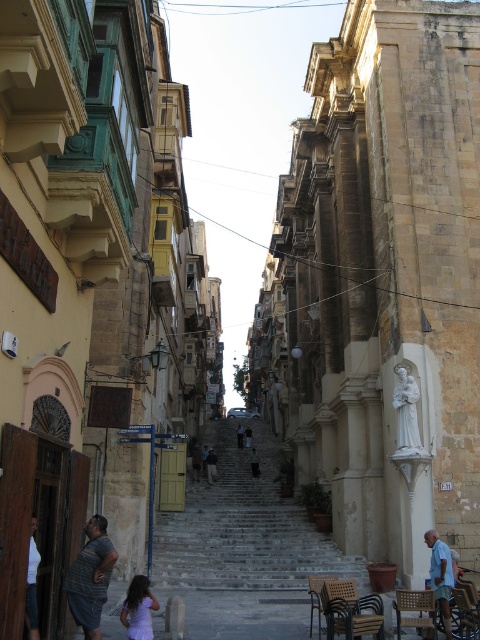
Question: Does purple satin dress at center appear over light blue fabric shirt at lower right?

Choices:
 (A) yes
 (B) no

Answer: (B)

Question: Where is gray fabric shirt at lower left located in relation to white cotton shirt at lower left in the image?

Choices:
 (A) below
 (B) above

Answer: (A)

Question: Which object is positioned farthest from the stone steps at center?

Choices:
 (A) purple satin dress at center
 (B) white cotton shirt at lower left

Answer: (B)

Question: Considering the real-world distances, which object is closest to the white cotton shirt at lower left?

Choices:
 (A) light blue fabric shirt at lower right
 (B) stone steps at center

Answer: (A)

Question: Does stone steps at center have a smaller size compared to purple satin dress at center?

Choices:
 (A) yes
 (B) no

Answer: (B)

Question: Based on their relative distances, which object is farther from the gray fabric shirt at lower left?

Choices:
 (A) white cotton shirt at lower left
 (B) purple satin dress at center

Answer: (A)